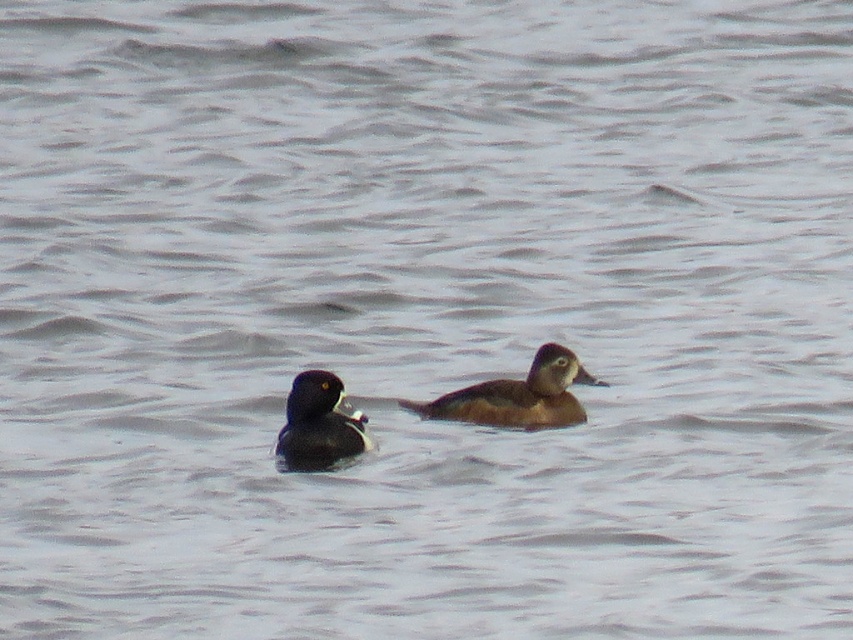
I want to click on brown fuzzy duck at center, so click(x=517, y=396).